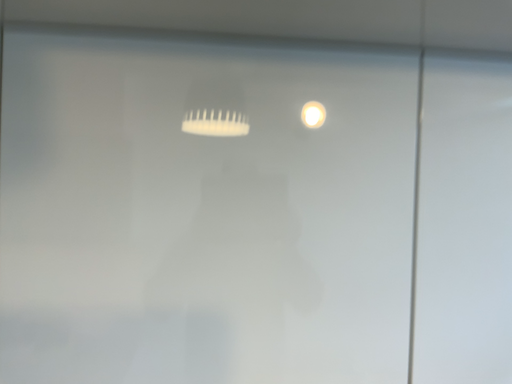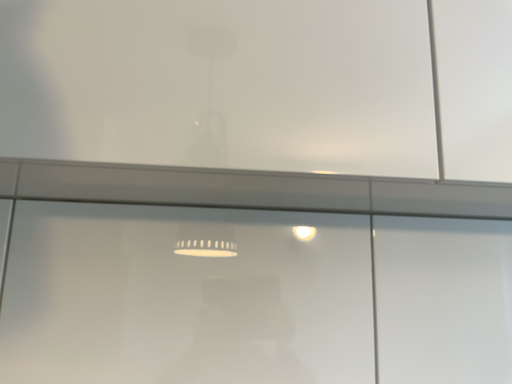
Question: How did the camera likely rotate when shooting the video?

Choices:
 (A) rotated downward
 (B) rotated upward

Answer: (B)